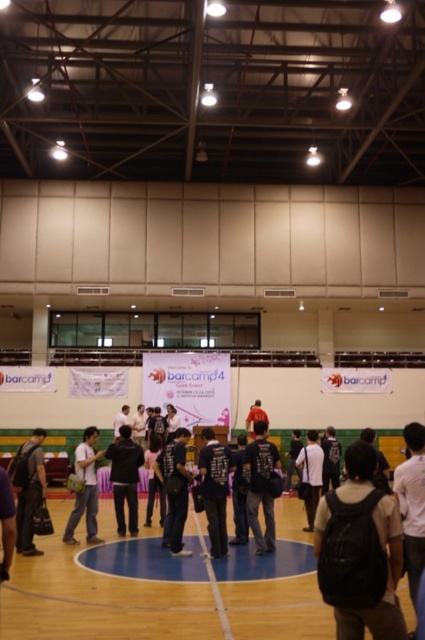
Does dark gray backpack at left appear on the left side of matte black backpack at center?

Yes, dark gray backpack at left is to the left of matte black backpack at center.

This screenshot has height=640, width=425. What do you see at coordinates (28, 490) in the screenshot? I see `dark gray backpack at left` at bounding box center [28, 490].

Which is behind, point (20, 468) or point (96, 486)?

Positioned behind is point (96, 486).

Find the location of a particular element. dark gray backpack at left is located at coordinates (28, 490).

Can you confirm if dark gray backpack at center is wider than matte black backpack at center?

Incorrect, dark gray backpack at center's width does not surpass matte black backpack at center's.

Does point (266, 499) come in front of point (82, 504)?

Yes, point (266, 499) is closer to viewer.

In order to click on dark gray backpack at center in this screenshot , I will do `click(260, 486)`.

Does wooden floor at center have a greater height compared to white matte shirt at right?

No, wooden floor at center is not taller than white matte shirt at right.

Between wooden floor at center and white matte shirt at right, which one has more height?

Standing taller between the two is white matte shirt at right.

Between point (57, 525) and point (416, 493), which one is positioned behind?

Point (57, 525)

Image resolution: width=425 pixels, height=640 pixels. I want to click on wooden floor at center, so click(159, 593).